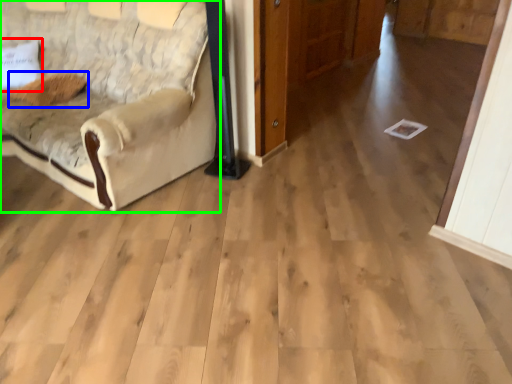
Question: Which object is the closest to the pillow (highlighted by a red box)? Choose among these: pillow (highlighted by a blue box) or studio couch (highlighted by a green box).

Choices:
 (A) pillow
 (B) studio couch

Answer: (A)